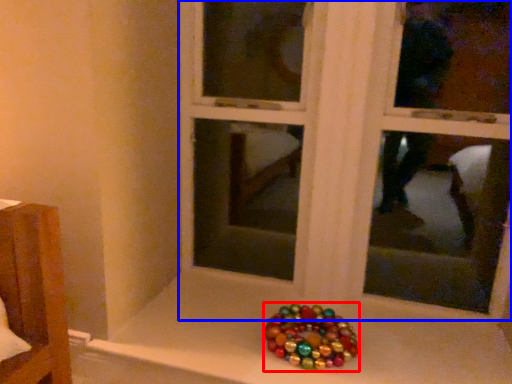
Question: Which of the following is the closest to the observer, glass bead (highlighted by a red box) or bay window (highlighted by a blue box)?

Choices:
 (A) glass bead
 (B) bay window

Answer: (B)